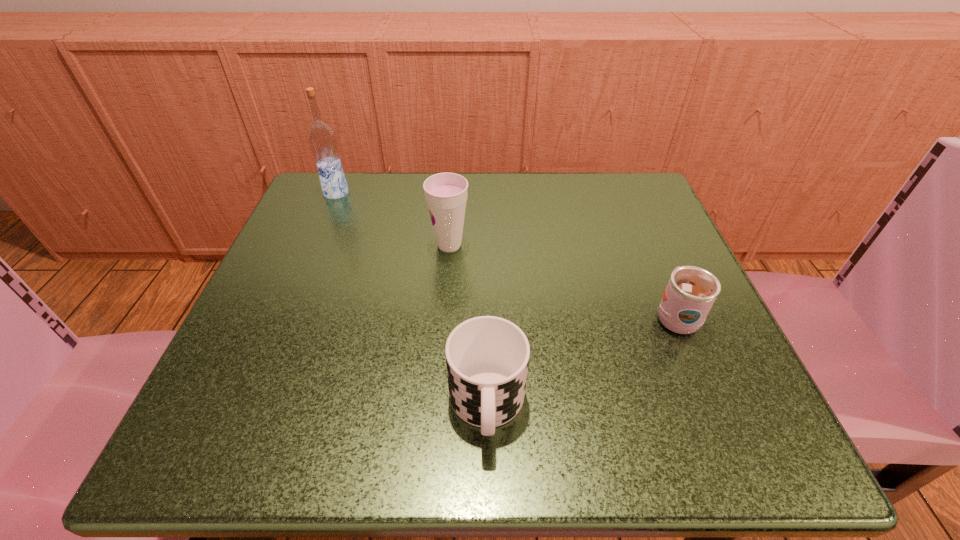
Identify the location of empty space that is in between the nearest cup and the farthest object. The width and height of the screenshot is (960, 540). (412, 299).

Where is `the third closest object to the tallest object`? the third closest object to the tallest object is located at coordinates (691, 291).

Find the location of a particular element. This screenshot has height=540, width=960. object that is the third nearest to the third farthest object is located at coordinates (322, 138).

Identify which cup is the nearest to the rightmost cup. Please provide its 2D coordinates. Your answer should be formatted as a tuple, i.e. [(x, y)], where the tuple contains the x and y coordinates of a point satisfying the conditions above.

[(487, 357)]

Identify the location of cup that is the second closest to the tallest object. This screenshot has width=960, height=540. (487, 357).